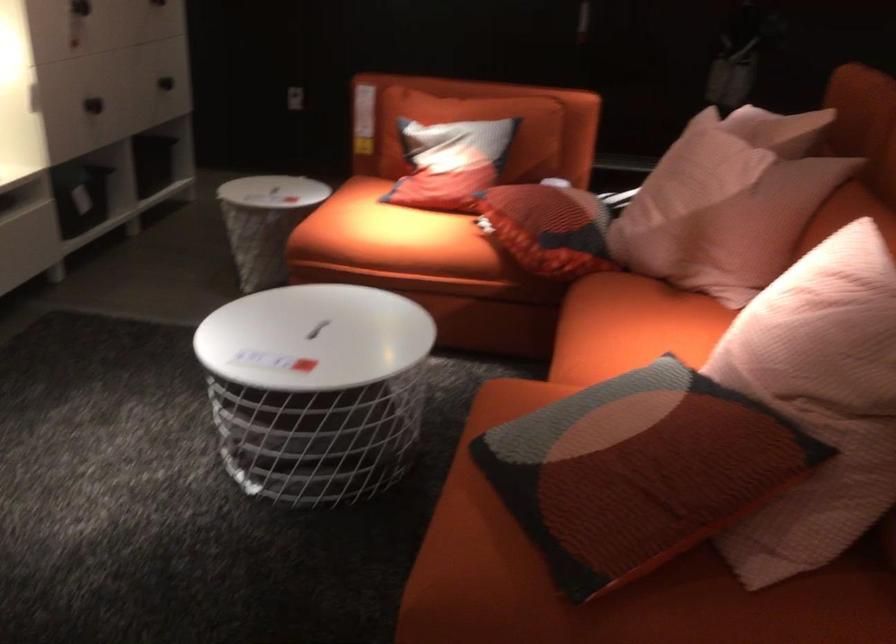
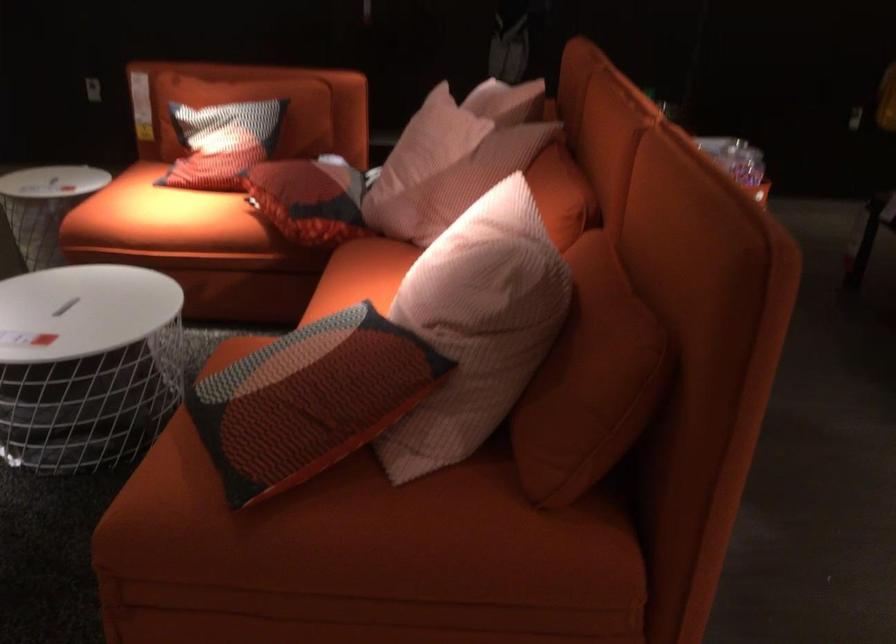
Where in the second image is the point corresponding to [452,158] from the first image?

(222, 142)